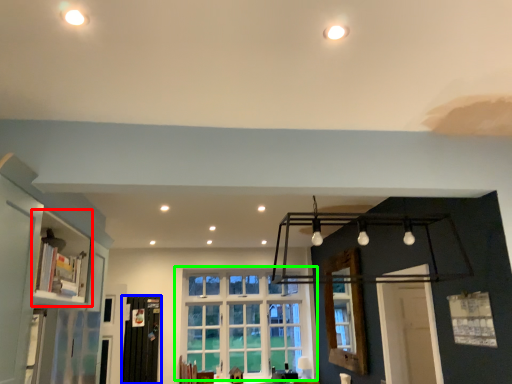
Question: Considering the real-world distances, which object is farthest from shelf (highlighted by a red box)? screen door (highlighted by a blue box) or window (highlighted by a green box)?

Choices:
 (A) screen door
 (B) window

Answer: (B)